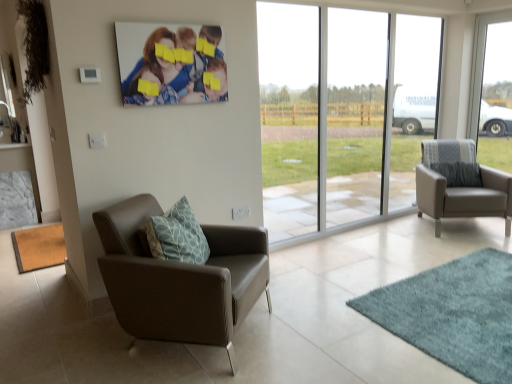
Question: Considering the relative sizes of transparent glass window at right, which is counted as the 1th window, starting from the right, and transparent glass window at center, which appears as the first window when viewed from the left, in the image provided, is transparent glass window at right, which is counted as the 1th window, starting from the right, shorter than transparent glass window at center, which appears as the first window when viewed from the left,?

Choices:
 (A) no
 (B) yes

Answer: (B)

Question: Considering the relative positions of transparent glass window at right, which is counted as the 1th window, starting from the right, and transparent glass window at center, which is the second window in right-to-left order, in the image provided, is transparent glass window at right, which is counted as the 1th window, starting from the right, in front of transparent glass window at center, which is the second window in right-to-left order,?

Choices:
 (A) no
 (B) yes

Answer: (A)

Question: Is transparent glass window at right, which is counted as the 1th window, starting from the right, smaller than transparent glass window at center, which is the second window in right-to-left order?

Choices:
 (A) yes
 (B) no

Answer: (A)

Question: Are transparent glass window at right, which is counted as the 1th window, starting from the right, and transparent glass window at center, which is the second window in right-to-left order, far apart?

Choices:
 (A) no
 (B) yes

Answer: (B)

Question: Is transparent glass window at right, the 2th window from the left, outside transparent glass window at center, which appears as the first window when viewed from the left?

Choices:
 (A) no
 (B) yes

Answer: (B)

Question: Considering their positions, is teal shaggy rug at lower right, arranged as the first mat when viewed from the front, located in front of or behind brown matte mat at lower left, which appears as the first mat when viewed from the left?

Choices:
 (A) behind
 (B) front

Answer: (B)

Question: Considering the positions of teal shaggy rug at lower right, arranged as the first mat when viewed from the front, and brown matte mat at lower left, positioned as the first mat in back-to-front order, in the image, is teal shaggy rug at lower right, arranged as the first mat when viewed from the front, wider or thinner than brown matte mat at lower left, positioned as the first mat in back-to-front order,?

Choices:
 (A) wide
 (B) thin

Answer: (A)

Question: Would you say teal shaggy rug at lower right, placed as the first mat when sorted from right to left, is to the left or to the right of brown matte mat at lower left, which appears as the first mat when viewed from the left, in the picture?

Choices:
 (A) right
 (B) left

Answer: (A)

Question: Is teal shaggy rug at lower right, acting as the 2th mat starting from the back, bigger or smaller than brown matte mat at lower left, the second mat positioned from the front?

Choices:
 (A) big
 (B) small

Answer: (A)

Question: Visually, is matte gray armchair at right, positioned as the 2th chair in left-to-right order, positioned to the left or to the right of teal shaggy rug at lower right, acting as the 2th mat starting from the back?

Choices:
 (A) left
 (B) right

Answer: (B)

Question: In terms of width, does matte gray armchair at right, the 1th chair from the back, look wider or thinner when compared to teal shaggy rug at lower right, arranged as the first mat when viewed from the front?

Choices:
 (A) thin
 (B) wide

Answer: (A)

Question: In terms of size, does matte gray armchair at right, which appears as the 1th chair when viewed from the right, appear bigger or smaller than teal shaggy rug at lower right, acting as the 2th mat starting from the back?

Choices:
 (A) big
 (B) small

Answer: (A)

Question: In the image, is matte gray armchair at right, which appears as the 1th chair when viewed from the right, positioned in front of or behind teal shaggy rug at lower right, acting as the 2th mat starting from the back?

Choices:
 (A) behind
 (B) front

Answer: (A)

Question: From a real-world perspective, relative to brown matte mat at lower left, positioned as the first mat in back-to-front order, is transparent glass window at right, the 2th window from the left, vertically above or below?

Choices:
 (A) below
 (B) above

Answer: (B)

Question: Considering the positions of transparent glass window at right, the 2th window from the left, and brown matte mat at lower left, positioned as the first mat in back-to-front order, in the image, is transparent glass window at right, the 2th window from the left, wider or thinner than brown matte mat at lower left, positioned as the first mat in back-to-front order,?

Choices:
 (A) thin
 (B) wide

Answer: (A)